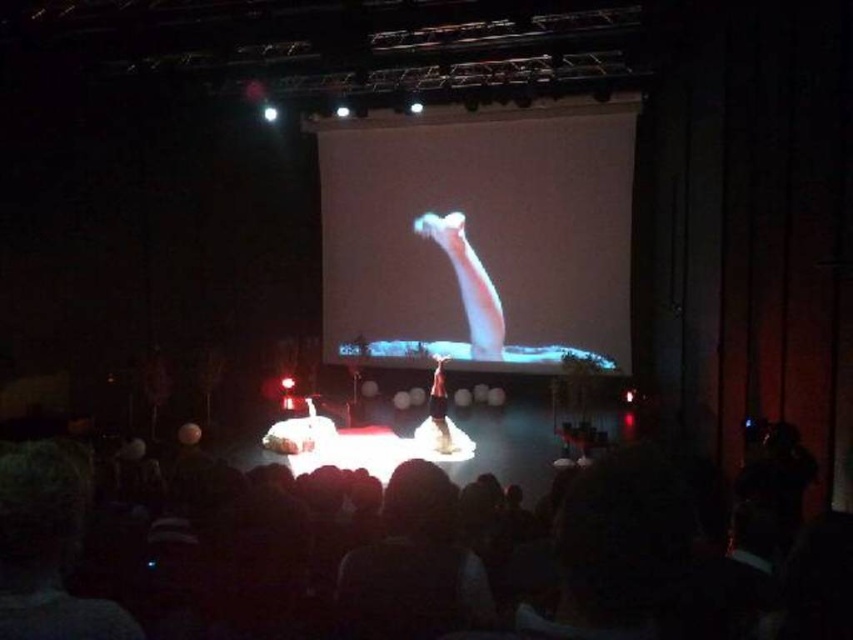
You are a stagehand who needs to adjust the lighting for the performance. You have to decide whether to focus the spotlight on the black fabric crowd at lower center or the white matte projection screen at center first. Based on their positions, which object is located to the left of the other?

The black fabric crowd at lower center is positioned on the left side of white matte projection screen at center, so it is located to the left of the white matte projection screen at center.

You are a stagehand in the theater. You need to place a new spotlight that will shine on the performer at the center of the stage. However, there is a black fabric crowd at lower center marked by point (589, 566). Will the spotlight aimed at the performer hit the black fabric crowd at lower center?

The point (589, 566) marks the black fabric crowd at lower center, so the spotlight aimed at the performer at the center of the stage might hit the black fabric crowd at lower center if the angle is not adjusted properly.